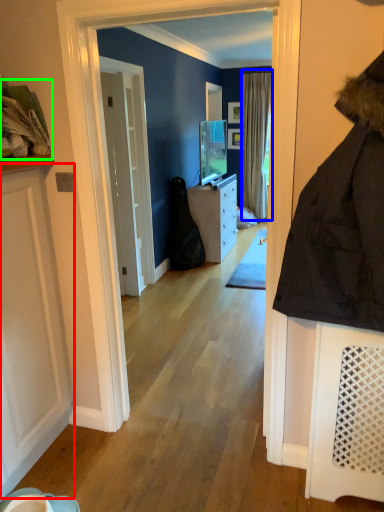
Question: Estimate the real-world distances between objects in this image. Which object is closer to door (highlighted by a red box), curtain (highlighted by a blue box) or laundry (highlighted by a green box)?

Choices:
 (A) curtain
 (B) laundry

Answer: (B)